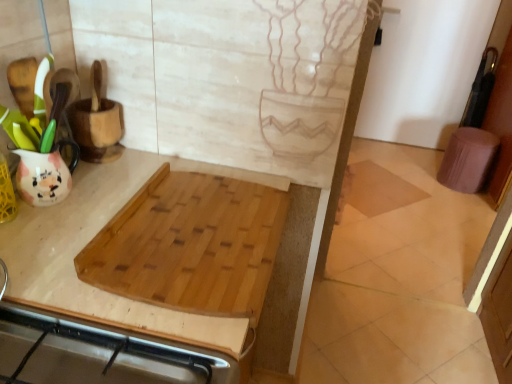
Identify the location of beige tile at center. The image size is (512, 384). (376, 189).

Where is `purple fabric step stool at right`? The width and height of the screenshot is (512, 384). purple fabric step stool at right is located at coordinates (467, 159).

Looking at the image, does natural wood cutting board at upper left seem bigger or smaller compared to natural wood cutting board at center?

Clearly, natural wood cutting board at upper left is larger in size than natural wood cutting board at center.

Do you think natural wood cutting board at upper left is within natural wood cutting board at center, or outside of it?

natural wood cutting board at upper left is not inside natural wood cutting board at center, it's outside.

From a real-world perspective, is natural wood cutting board at upper left physically above natural wood cutting board at center?

Actually, natural wood cutting board at upper left is physically below natural wood cutting board at center in the real world.

Which is nearer, (466, 183) or (225, 351)?

Clearly, point (466, 183) is more distant from the camera than point (225, 351).

Consider the image. Is purple fabric step stool at right facing towards natural wood cutting board at upper left?

No, purple fabric step stool at right is not facing towards natural wood cutting board at upper left.

From the picture: Which is behind, purple fabric step stool at right or natural wood cutting board at upper left?

purple fabric step stool at right.

From a real-world perspective, is purple fabric step stool at right below natural wood cutting board at upper left?

Indeed, from a real-world perspective, purple fabric step stool at right is positioned beneath natural wood cutting board at upper left.

Which object is further away from the camera, natural wood cutting board at center or beige tile at center?

beige tile at center.

From a real-world perspective, between natural wood cutting board at center and beige tile at center, who is vertically lower?

beige tile at center, from a real-world perspective.

Can you confirm if natural wood cutting board at center is wider than beige tile at center?

Incorrect, the width of natural wood cutting board at center does not surpass that of beige tile at center.

Between natural wood cutting board at center and beige tile at center, which one appears on the left side from the viewer's perspective?

From the viewer's perspective, natural wood cutting board at center appears more on the left side.

Is beige tile at center oriented away from natural wood cutting board at center?

That's not correct — beige tile at center is not looking away from natural wood cutting board at center.

Is beige tile at center closer to camera compared to natural wood cutting board at center?

No, beige tile at center is further to the viewer.

Is beige tile at center bigger or smaller than natural wood cutting board at center?

Considering their sizes, beige tile at center takes up less space than natural wood cutting board at center.

Looking at this image, from a real-world perspective, is purple fabric step stool at right positioned above or below beige tile at center?

purple fabric step stool at right is situated higher than beige tile at center in the real world.

Looking at this image, would you say purple fabric step stool at right is a long distance from beige tile at center?

No, purple fabric step stool at right is in close proximity to beige tile at center.

From the image's perspective, is purple fabric step stool at right below beige tile at center?

No, from the image's perspective, purple fabric step stool at right is not below beige tile at center.

How different are the orientations of natural wood cutting board at upper left and purple fabric step stool at right in degrees?

The facing directions of natural wood cutting board at upper left and purple fabric step stool at right are 88.9 degrees apart.

Is purple fabric step stool at right located within natural wood cutting board at upper left?

No.

Is natural wood cutting board at upper left to the left of purple fabric step stool at right from the viewer's perspective?

Yes, natural wood cutting board at upper left is to the left of purple fabric step stool at right.

Does natural wood cutting board at upper left have a smaller size compared to purple fabric step stool at right?

Actually, natural wood cutting board at upper left might be larger than purple fabric step stool at right.

Looking at this image, is natural wood cutting board at upper left situated inside beige tile at center or outside?

natural wood cutting board at upper left is not enclosed by beige tile at center.

Based on the photo, is natural wood cutting board at upper left next to beige tile at center?

natural wood cutting board at upper left and beige tile at center are not in contact.

Which of these two, natural wood cutting board at upper left or beige tile at center, stands shorter?

With less height is beige tile at center.

Which is more to the right, natural wood cutting board at upper left or beige tile at center?

beige tile at center is more to the right.

In the image, there is a natural wood cutting board at center. Identify the location of countertop below it (from the image's perspective). (146, 303).

What are the coordinates of `countertop on the left of purple fabric step stool at right` in the screenshot? It's located at (146, 303).

When comparing their distances from purple fabric step stool at right, does natural wood cutting board at center or beige tile at center seem closer?

Based on the image, beige tile at center appears to be nearer to purple fabric step stool at right.

Based on their spatial positions, is beige tile at center or natural wood cutting board at upper left further from natural wood cutting board at center?

The object further to natural wood cutting board at center is beige tile at center.

Looking at this image, which object lies further to the anchor point purple fabric step stool at right, natural wood cutting board at center or natural wood cutting board at upper left?

Based on the image, natural wood cutting board at center appears to be further to purple fabric step stool at right.

Considering their positions, is beige tile at center positioned closer to natural wood cutting board at upper left than natural wood cutting board at center?

Based on the image, natural wood cutting board at center appears to be nearer to natural wood cutting board at upper left.

When comparing their distances from purple fabric step stool at right, does beige tile at center or natural wood cutting board at upper left seem closer?

beige tile at center is positioned closer to the anchor purple fabric step stool at right.

Which object lies further to the anchor point natural wood cutting board at center, purple fabric step stool at right or natural wood cutting board at upper left?

purple fabric step stool at right lies further to natural wood cutting board at center than the other object.

Based on the photo, from the image, which object appears to be farther from beige tile at center, natural wood cutting board at center or purple fabric step stool at right?

natural wood cutting board at center is further to beige tile at center.

From the image, which object appears to be nearer to natural wood cutting board at center, purple fabric step stool at right or beige tile at center?

beige tile at center lies closer to natural wood cutting board at center than the other object.

Locate an element on the screen. cutting board between natural wood cutting board at upper left and purple fabric step stool at right in the front-back direction is located at coordinates (190, 245).

Where is `tile located between natural wood cutting board at upper left and purple fabric step stool at right in the depth direction`? This screenshot has width=512, height=384. tile located between natural wood cutting board at upper left and purple fabric step stool at right in the depth direction is located at coordinates (376, 189).

You are a GUI agent. You are given a task and a screenshot of the screen. Output one action in this format:
    pyautogui.click(x=<x>, y=<y>)
    Task: Click on the tile positioned between natural wood cutting board at center and purple fabric step stool at right from near to far
    The width and height of the screenshot is (512, 384).
    Given the screenshot: What is the action you would take?
    pyautogui.click(x=376, y=189)

Locate an element on the screen. The height and width of the screenshot is (384, 512). cutting board between natural wood cutting board at upper left and beige tile at center from front to back is located at coordinates (190, 245).